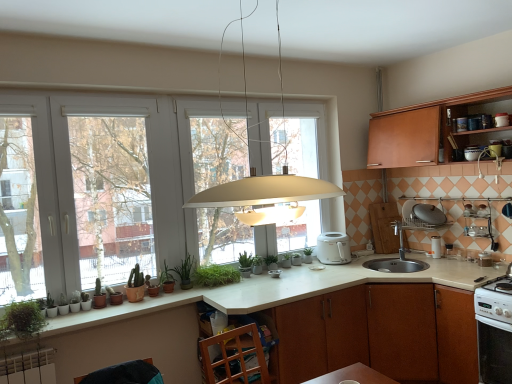
Question: From the image's perspective, is white glossy oven at lower right, marked as the first kitchen appliance in a right-to-left arrangement, on top of white laminate countertop at center?

Choices:
 (A) yes
 (B) no

Answer: (B)

Question: Is white glossy oven at lower right, which is counted as the second kitchen appliance, starting from the top, taller than white laminate countertop at center?

Choices:
 (A) no
 (B) yes

Answer: (A)

Question: Is the position of white glossy oven at lower right, which appears as the second kitchen appliance when viewed from the left, more distant than that of white laminate countertop at center?

Choices:
 (A) no
 (B) yes

Answer: (B)

Question: Is white glossy oven at lower right, which is counted as the second kitchen appliance, starting from the top, completely or partially outside of white laminate countertop at center?

Choices:
 (A) yes
 (B) no

Answer: (A)

Question: Considering the relative sizes of white glossy oven at lower right, the first kitchen appliance ordered from the bottom, and white laminate countertop at center in the image provided, is white glossy oven at lower right, the first kitchen appliance ordered from the bottom, bigger than white laminate countertop at center?

Choices:
 (A) no
 (B) yes

Answer: (A)

Question: Could you tell me if white glossy oven at lower right, marked as the first kitchen appliance in a right-to-left arrangement, is turned towards white laminate countertop at center?

Choices:
 (A) yes
 (B) no

Answer: (B)

Question: Is white plastic toaster at upper right, which ranks as the 1th kitchen appliance in top-to-bottom order, closer to the viewer compared to green matte plant at lower left, which ranks as the 2th plant in back-to-front order?

Choices:
 (A) no
 (B) yes

Answer: (A)

Question: Is white plastic toaster at upper right, which is counted as the first kitchen appliance, starting from the left, facing away from green matte plant at lower left, acting as the 5th plant starting from the front?

Choices:
 (A) yes
 (B) no

Answer: (B)

Question: From a real-world perspective, does white plastic toaster at upper right, the second kitchen appliance viewed from the front, stand above green matte plant at lower left, the third plant when ordered from right to left?

Choices:
 (A) yes
 (B) no

Answer: (B)

Question: Is the position of white plastic toaster at upper right, which ranks as the 1th kitchen appliance in top-to-bottom order, more distant than that of green matte plant at lower left, acting as the 5th plant starting from the front?

Choices:
 (A) yes
 (B) no

Answer: (A)

Question: Is white plastic toaster at upper right, which is counted as the first kitchen appliance, starting from the left, directly adjacent to green matte plant at lower left, the third plant when ordered from right to left?

Choices:
 (A) no
 (B) yes

Answer: (A)

Question: Is white plastic toaster at upper right, placed as the second kitchen appliance when sorted from right to left, to the right of green matte plant at lower left, which ranks as the 2th plant in back-to-front order, from the viewer's perspective?

Choices:
 (A) yes
 (B) no

Answer: (A)

Question: Is brown wood cabinet at lower center, marked as the first cabinetry in a bottom-to-top arrangement, thinner than white glossy oven at lower right, which is counted as the second kitchen appliance, starting from the top?

Choices:
 (A) no
 (B) yes

Answer: (A)